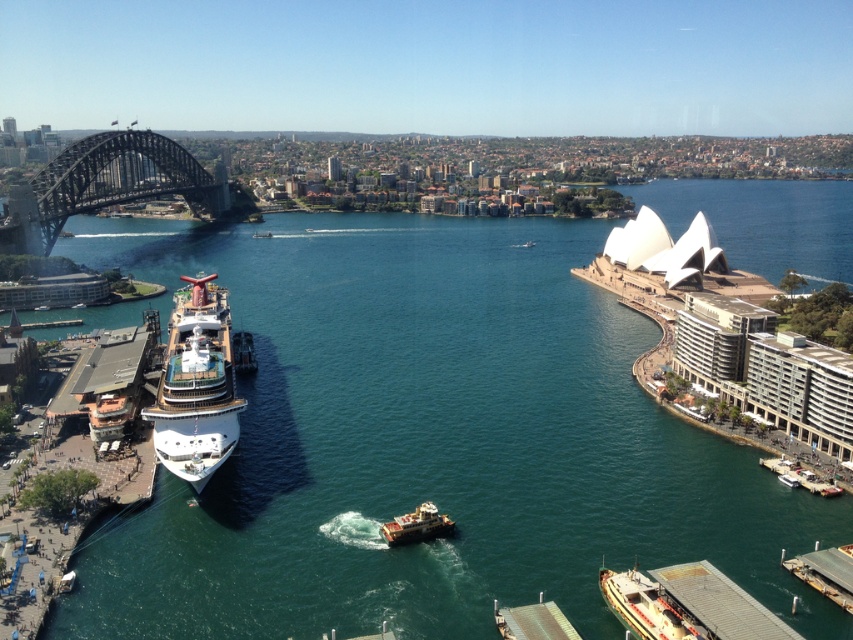
Question: Can you confirm if white glossy cruise ship at center is positioned above white plastic boat at center?

Choices:
 (A) yes
 (B) no

Answer: (A)

Question: Which object is positioned farthest from the white glossy cruise ship at center?

Choices:
 (A) metallic gray boat at lower right
 (B) dark steel bridge at left
 (C) white plastic boat at center

Answer: (B)

Question: Does green water at center have a greater width compared to white plastic boat at center?

Choices:
 (A) no
 (B) yes

Answer: (B)

Question: Which point is farther to the camera?

Choices:
 (A) click(x=433, y=563)
 (B) click(x=28, y=234)
 (C) click(x=392, y=522)
 (D) click(x=206, y=412)

Answer: (B)

Question: Which object is the closest to the metallic gray boat at lower right?

Choices:
 (A) green water at center
 (B) white glossy cruise ship at center

Answer: (B)

Question: Is green water at center closer to the viewer compared to white glossy cruise ship at center?

Choices:
 (A) yes
 (B) no

Answer: (A)